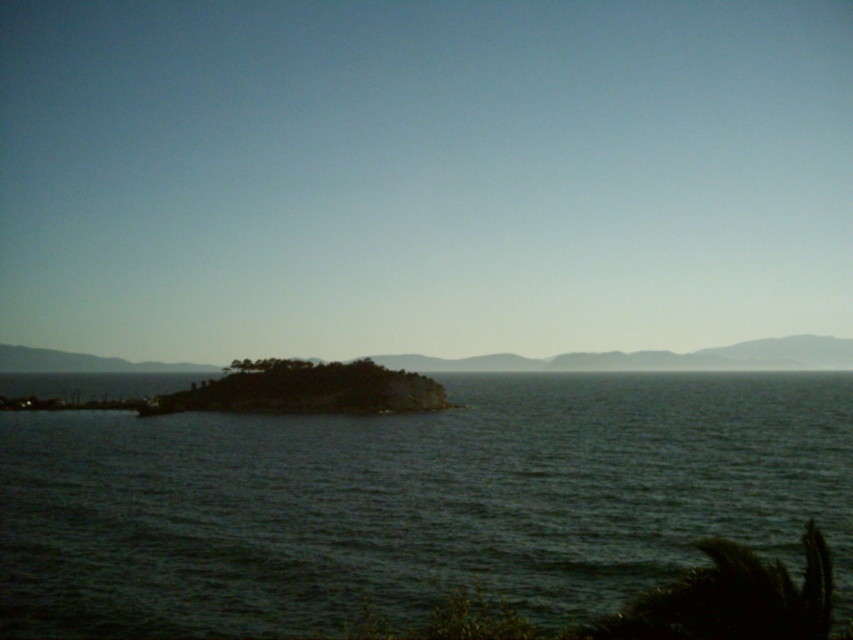
Question: Does dark water at center come in front of smooth gray horizon at center?

Choices:
 (A) no
 (B) yes

Answer: (B)

Question: Is dark water at center bigger than green mossy rock at center?

Choices:
 (A) yes
 (B) no

Answer: (A)

Question: Which object is closer to the camera taking this photo?

Choices:
 (A) green mossy rock at center
 (B) dark water at center
 (C) smooth gray horizon at center

Answer: (B)

Question: Which object is positioned closest to the dark water at center?

Choices:
 (A) smooth gray horizon at center
 (B) green mossy rock at center

Answer: (B)

Question: Which point is closer to the camera?

Choices:
 (A) (384, 360)
 (B) (189, 392)
 (C) (212, 456)

Answer: (C)

Question: Can you confirm if smooth gray horizon at center is smaller than green mossy rock at center?

Choices:
 (A) no
 (B) yes

Answer: (A)